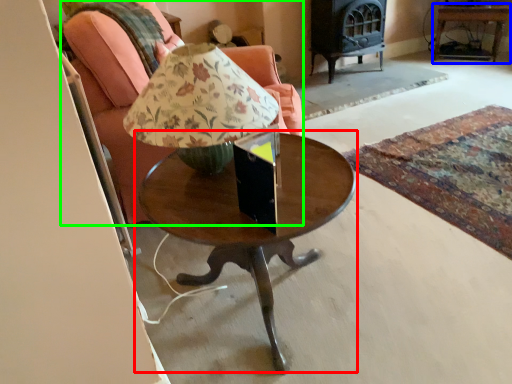
Question: Considering the real-world distances, which object is farthest from coffee table (highlighted by a red box)? side table (highlighted by a blue box) or chair (highlighted by a green box)?

Choices:
 (A) side table
 (B) chair

Answer: (A)